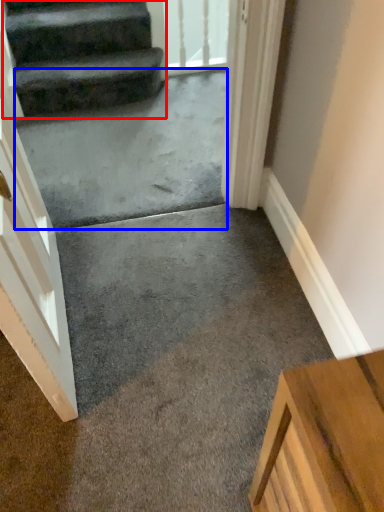
Question: Which object is closer to the camera taking this photo, stairs (highlighted by a red box) or concrete (highlighted by a blue box)?

Choices:
 (A) stairs
 (B) concrete

Answer: (B)